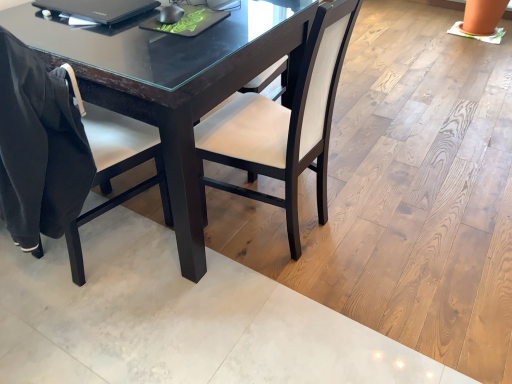
Find the location of a particular element. The height and width of the screenshot is (384, 512). free location in front of black matte chair at left, placed as the first chair when sorted from left to right is located at coordinates (87, 312).